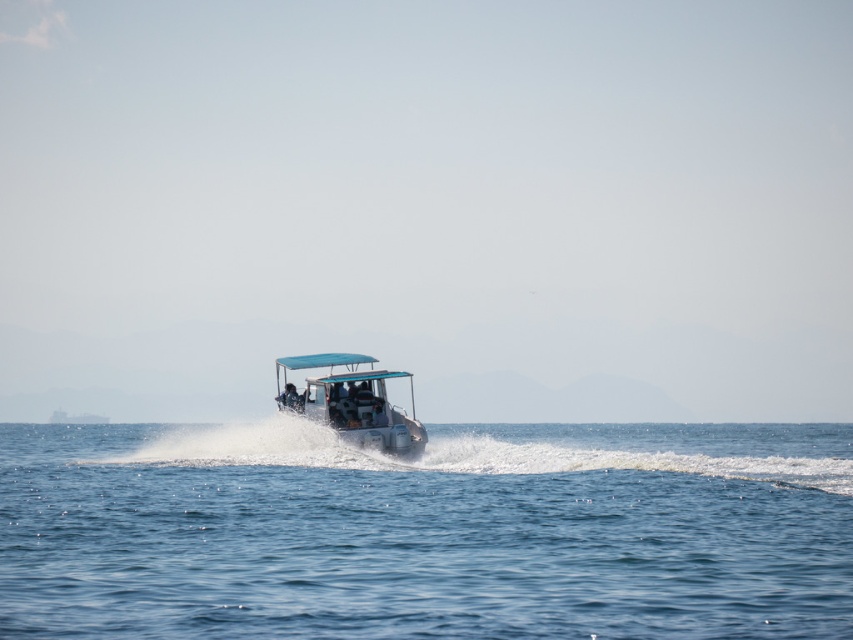
Question: Is blue water at center bigger than white plastic boat at center?

Choices:
 (A) no
 (B) yes

Answer: (B)

Question: Which of the following is the closest to the observer?

Choices:
 (A) (699, 444)
 (B) (312, 419)

Answer: (B)

Question: Which of the following is the farthest from the observer?

Choices:
 (A) blue water at center
 (B) white plastic boat at center

Answer: (B)

Question: Does blue water at center lie behind white plastic boat at center?

Choices:
 (A) no
 (B) yes

Answer: (A)

Question: Does blue water at center appear on the right side of white plastic boat at center?

Choices:
 (A) yes
 (B) no

Answer: (A)